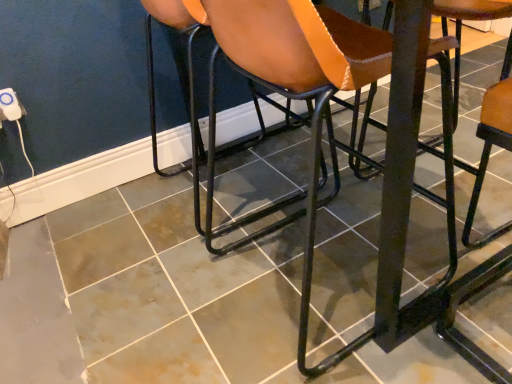
Find the location of a particular element. This screenshot has width=512, height=384. vacant location behind metallic black stool at right, which is the third chair in left-to-right order is located at coordinates (453, 273).